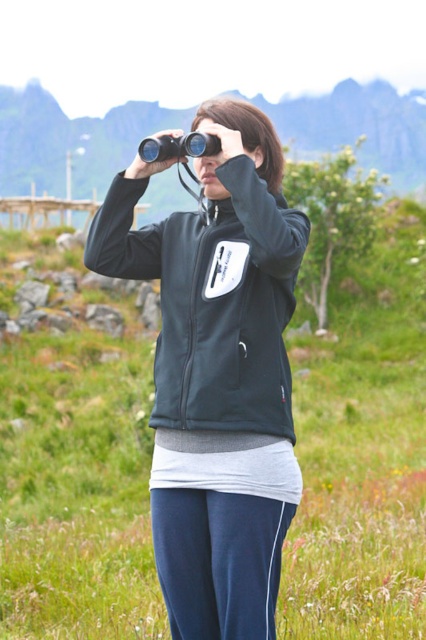
Question: Does matte black sweatshirt at center have a smaller size compared to green grass at center?

Choices:
 (A) no
 (B) yes

Answer: (B)

Question: Which of the following is the farthest from the observer?

Choices:
 (A) matte black sweatshirt at center
 (B) green grass at center

Answer: (B)

Question: Is matte black sweatshirt at center in front of green grass at center?

Choices:
 (A) yes
 (B) no

Answer: (A)

Question: Which point is farther from the camera taking this photo?

Choices:
 (A) (x=141, y=129)
 (B) (x=170, y=333)

Answer: (A)

Question: Is matte black sweatshirt at center positioned behind green grass at center?

Choices:
 (A) no
 (B) yes

Answer: (A)

Question: Among these objects, which one is farthest from the camera?

Choices:
 (A) green grass at center
 (B) matte black sweatshirt at center

Answer: (A)